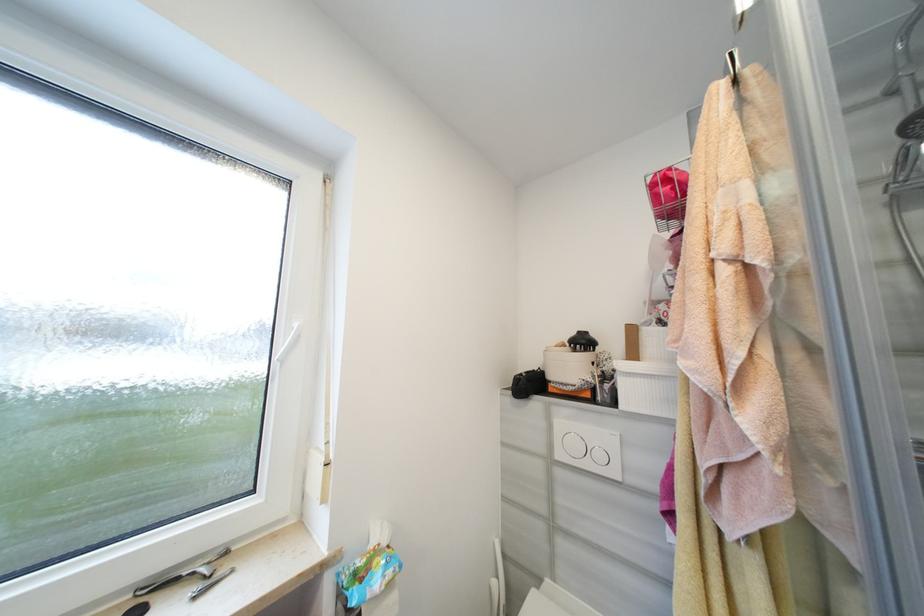
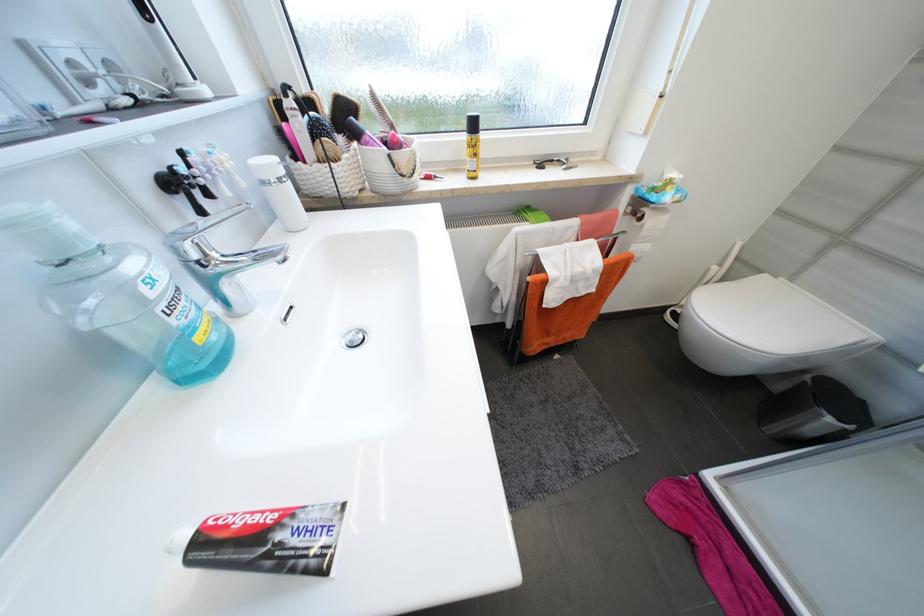
First-person continuous shooting, in which direction is the camera rotating?

The rotation direction of the camera is left-down.